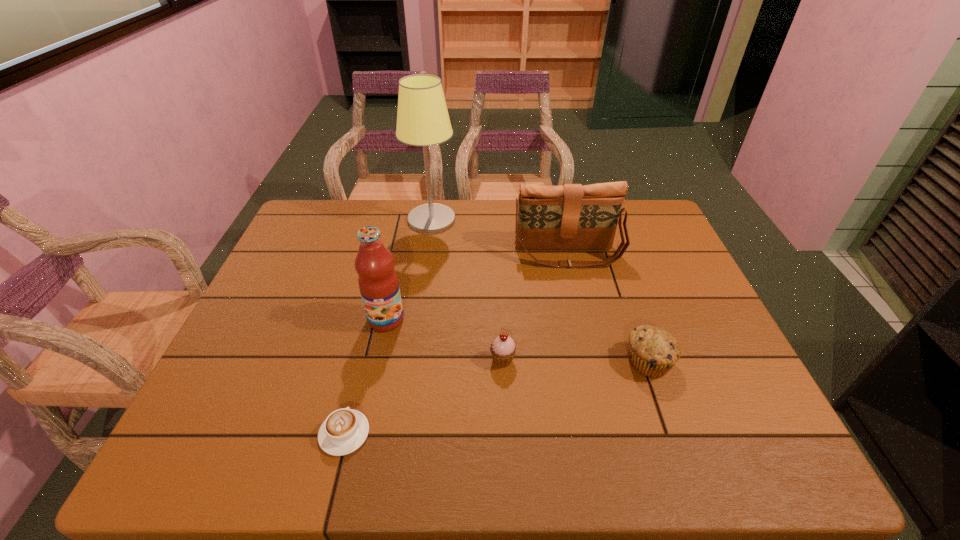
Where is `vacant space in between the farthest object and the fifth nearest object`? This screenshot has width=960, height=540. vacant space in between the farthest object and the fifth nearest object is located at coordinates (500, 237).

At what (x,y) coordinates should I click in order to perform the action: click on vacant area between the cappuccino and the third object from right to left. Please return your answer as a coordinate pair (x, y). The image size is (960, 540). Looking at the image, I should click on (423, 396).

Find the location of a particular element. This screenshot has width=960, height=540. vacant space that is in between the fruit juice and the tallest object is located at coordinates (409, 269).

Where is `vacant area that lies between the fruit juice and the muffin`? Image resolution: width=960 pixels, height=540 pixels. vacant area that lies between the fruit juice and the muffin is located at coordinates (517, 340).

The width and height of the screenshot is (960, 540). In order to click on free area in between the muffin and the fourth shortest object in this screenshot , I will do `click(608, 308)`.

This screenshot has height=540, width=960. What are the coordinates of `vacant region between the third object from right to left and the farthest object` in the screenshot? It's located at (468, 290).

The width and height of the screenshot is (960, 540). Identify the location of vacant point located between the muffin and the shortest object. tap(496, 397).

Identify which object is the second closest to the shortest object. Please provide its 2D coordinates. Your answer should be formatted as a tuple, i.e. [(x, y)], where the tuple contains the x and y coordinates of a point satisfying the conditions above.

[(502, 349)]

Select which object is the second closest to the fruit juice. Please provide its 2D coordinates. Your answer should be formatted as a tuple, i.e. [(x, y)], where the tuple contains the x and y coordinates of a point satisfying the conditions above.

[(502, 349)]

Locate an element on the screen. vacant space that satisfies the following two spatial constraints: 1. on the front label of the fourth nearest object; 2. on the right side of the cupcake is located at coordinates (377, 360).